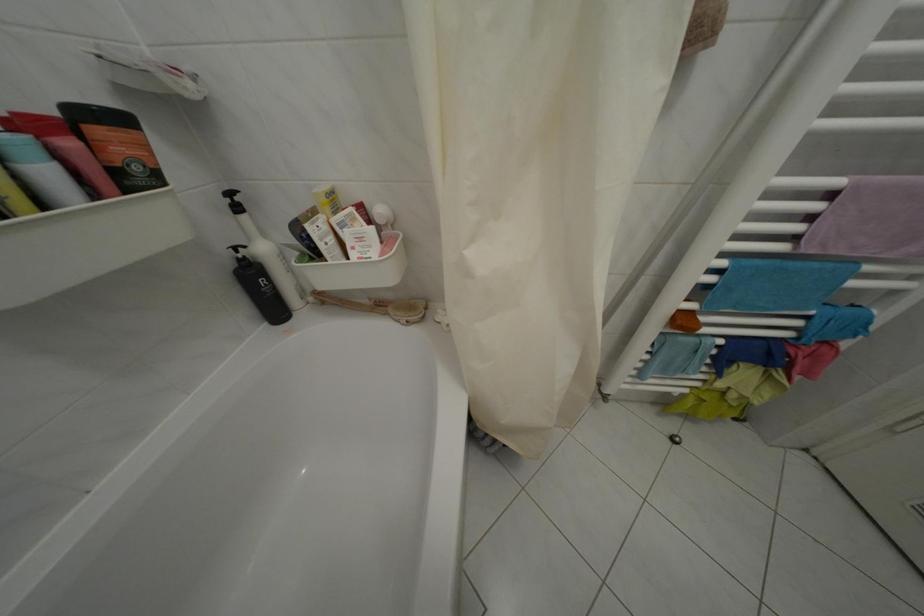
Image resolution: width=924 pixels, height=616 pixels. I want to click on black cosmetic container, so point(261,292).